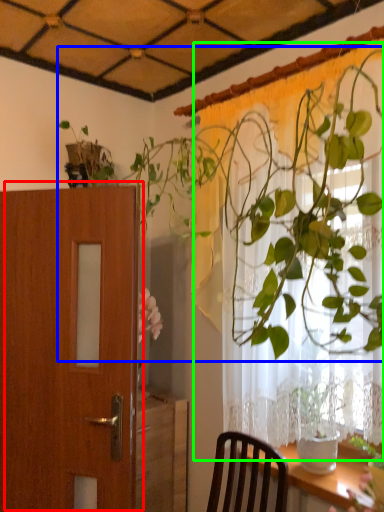
Question: Based on their relative distances, which object is nearer to door (highlighted by a red box)? Choose from houseplant (highlighted by a blue box) and curtain (highlighted by a green box).

Choices:
 (A) houseplant
 (B) curtain

Answer: (A)